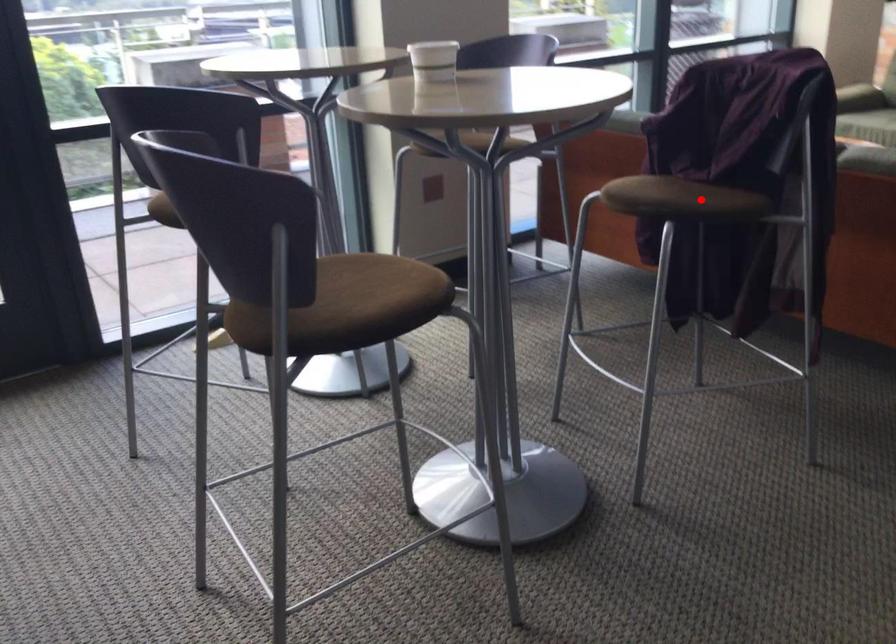
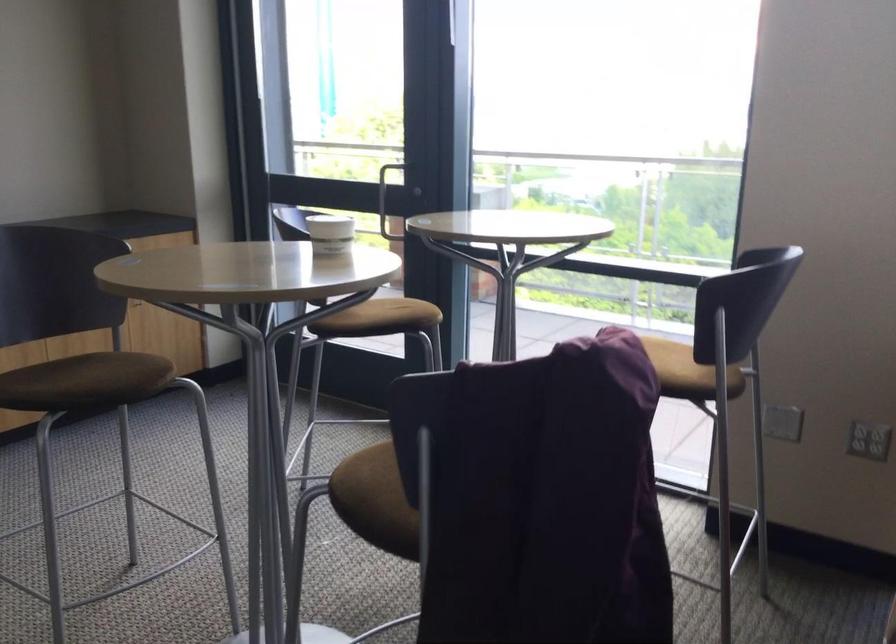
Question: I am providing you with two images of the same scene from different viewpoints. A red point is marked on the first image. Can you still see the location of the red point in image 2?

Choices:
 (A) Yes
 (B) No

Answer: (A)